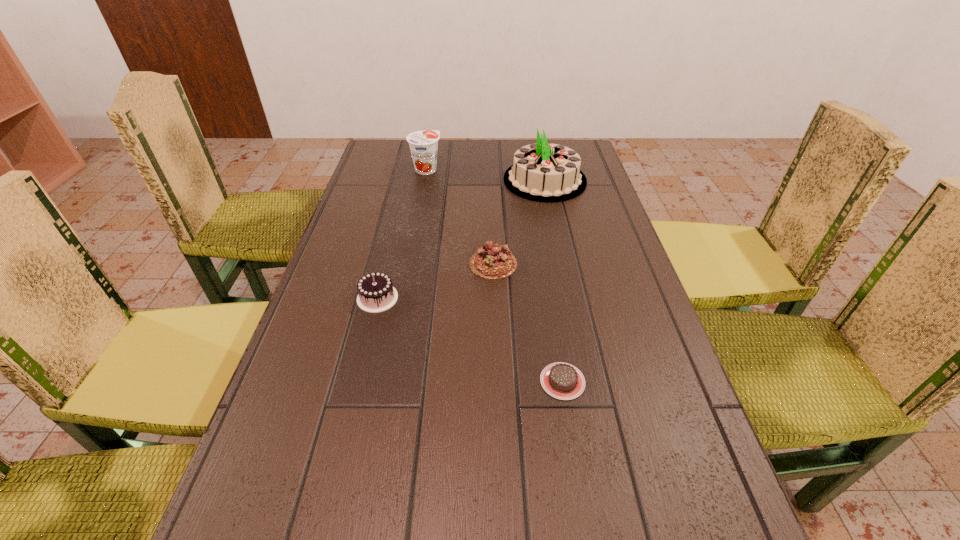
Find the location of `free space at the far edge of the desktop`. free space at the far edge of the desktop is located at coordinates (487, 168).

Image resolution: width=960 pixels, height=540 pixels. Find the location of `free region at the left edge of the desktop`. free region at the left edge of the desktop is located at coordinates 334,271.

The width and height of the screenshot is (960, 540). I want to click on vacant space at the right edge of the desktop, so click(x=603, y=187).

Where is `free space at the far left corner of the desktop`? Image resolution: width=960 pixels, height=540 pixels. free space at the far left corner of the desktop is located at coordinates 397,148.

In order to click on vacant point located between the rightmost chocolate cake and the third farthest object in this screenshot , I will do `click(528, 322)`.

I want to click on free point between the tallest chocolate cake and the fourth tallest object, so click(x=435, y=281).

Find the location of `unoccupied area between the shortest chocolate cake and the second farthest chocolate cake`. unoccupied area between the shortest chocolate cake and the second farthest chocolate cake is located at coordinates (470, 340).

Where is `vacant area that lies between the third tallest object and the second tallest object`? vacant area that lies between the third tallest object and the second tallest object is located at coordinates (401, 234).

Identify the location of empty space between the second farthest chocolate cake and the shortest chocolate cake. (470, 340).

Where is `empty space that is in between the third shortest object and the tallest object`? empty space that is in between the third shortest object and the tallest object is located at coordinates (461, 239).